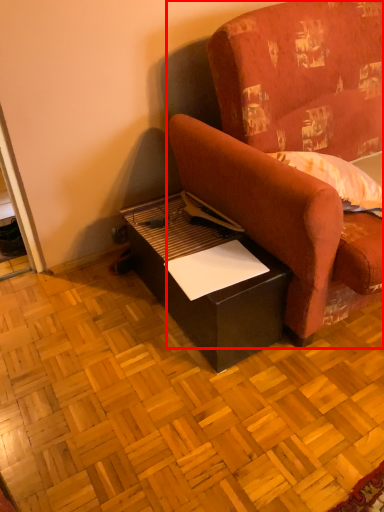
Question: From the image's perspective, where is studio couch (annotated by the red box) located relative to table?

Choices:
 (A) below
 (B) above

Answer: (B)